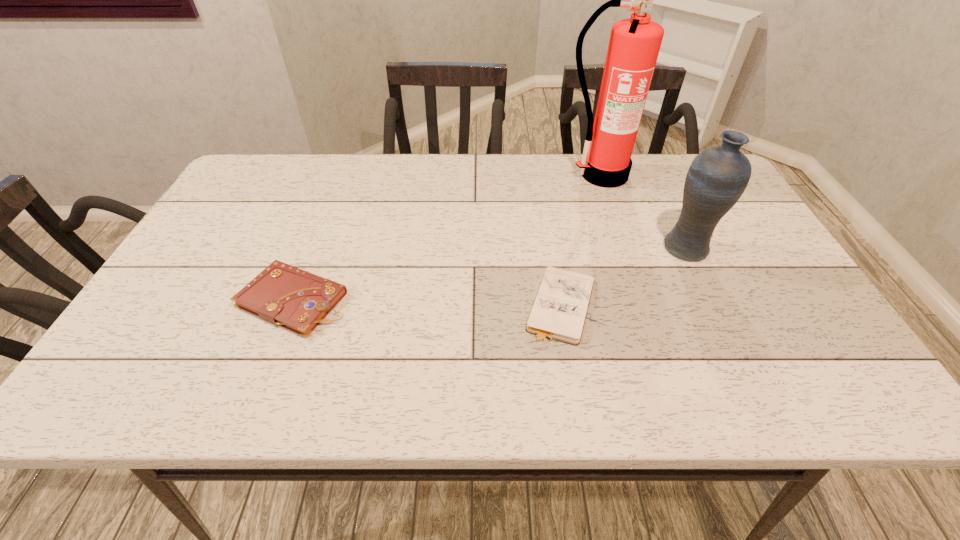
I want to click on vacant space located on the right of the taller notebook, so click(500, 300).

Where is `vacant area located 0.080m on the front of the shorter notebook`? The height and width of the screenshot is (540, 960). vacant area located 0.080m on the front of the shorter notebook is located at coordinates (572, 380).

The height and width of the screenshot is (540, 960). Find the location of `object that is at the far edge`. object that is at the far edge is located at coordinates (634, 45).

Identify the location of object positioned at the right edge. The image size is (960, 540). (716, 179).

Find the location of a particular element. This screenshot has width=960, height=540. vacant area at the far edge of the desktop is located at coordinates (444, 188).

Find the location of a particular element. This screenshot has width=960, height=540. free location at the near edge of the desktop is located at coordinates (370, 401).

This screenshot has width=960, height=540. Identify the location of vacant region at the left edge. (213, 232).

At what (x,y) coordinates should I click in order to perform the action: click on vacant point at the right edge. Please return your answer as a coordinate pair (x, y). Looking at the image, I should click on (810, 354).

In the image, there is a desktop. At what (x,y) coordinates should I click in order to perform the action: click on vacant space at the far left corner. Please return your answer as a coordinate pair (x, y). Image resolution: width=960 pixels, height=540 pixels. Looking at the image, I should click on (273, 174).

In the image, there is a desktop. At what (x,y) coordinates should I click in order to perform the action: click on free region at the near left corner. Please return your answer as a coordinate pair (x, y). Looking at the image, I should click on (159, 369).